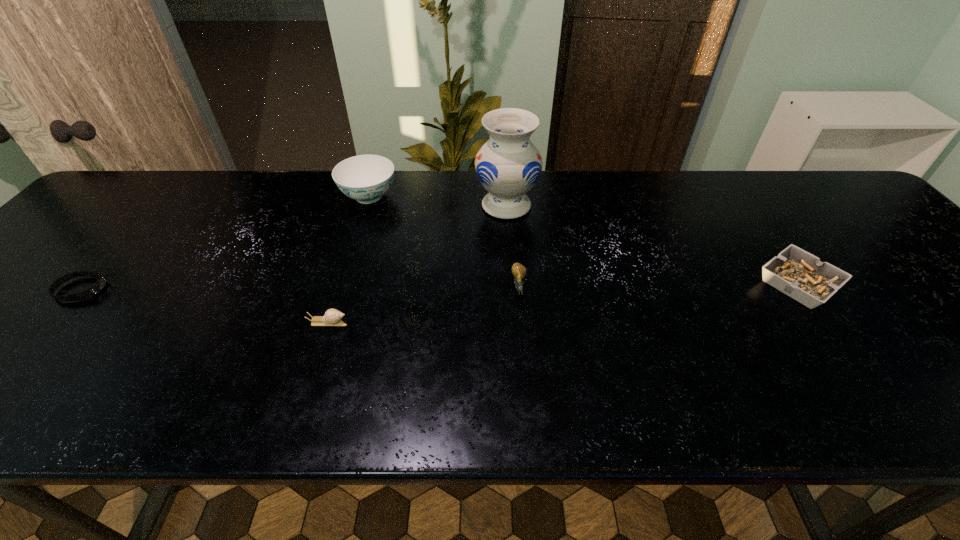
Locate an element on the screen. vacant position at the left edge of the desktop is located at coordinates (123, 228).

Where is `vacant area at the right edge`? This screenshot has width=960, height=540. vacant area at the right edge is located at coordinates (878, 266).

The height and width of the screenshot is (540, 960). Identify the location of vacant region between the nearest object and the tallest object. (418, 264).

Identify the location of vacant space in between the chinaware and the shorter escargot. This screenshot has height=540, width=960. (348, 259).

Find the location of a particular element. free spot between the tallest object and the leftmost object is located at coordinates (294, 248).

Identify the location of vacant region between the taller escargot and the rightmost object. The width and height of the screenshot is (960, 540). (659, 285).

Where is `empty space that is in between the tallest object and the chinaware`? empty space that is in between the tallest object and the chinaware is located at coordinates (438, 201).

Identify the location of free spot between the vase and the ashtray. The image size is (960, 540). (652, 245).

Where is `unoccupied position between the shorter escargot and the shortest object`? Image resolution: width=960 pixels, height=540 pixels. unoccupied position between the shorter escargot and the shortest object is located at coordinates (204, 306).

This screenshot has width=960, height=540. I want to click on empty location between the leftmost object and the ashtray, so click(440, 287).